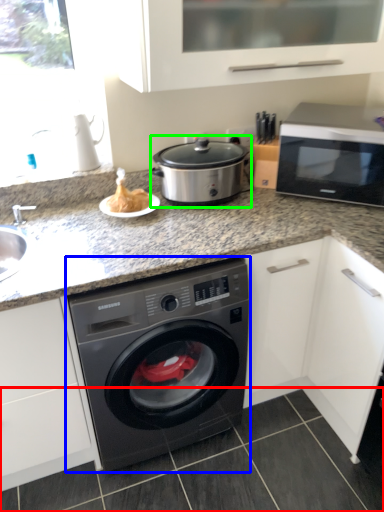
Question: Estimate the real-world distances between objects in this image. Which object is closer to tile (highlighted by a red box), washing machine (highlighted by a blue box) or slow cooker (highlighted by a green box)?

Choices:
 (A) washing machine
 (B) slow cooker

Answer: (A)